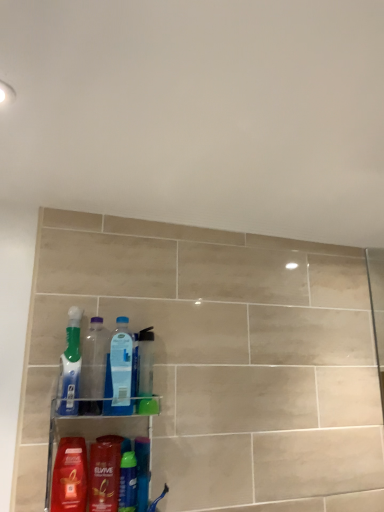
Question: Can you confirm if translucent plastic bottles at lower center is shorter than translucent plastic mouthwash at lower center, the first mouthwash from the left?

Choices:
 (A) yes
 (B) no

Answer: (B)

Question: From a real-world perspective, is translucent plastic bottles at lower center beneath translucent plastic mouthwash at lower center, the first mouthwash from the left?

Choices:
 (A) yes
 (B) no

Answer: (B)

Question: Is translucent plastic bottles at lower center closer to the viewer compared to translucent plastic mouthwash at lower center, the first mouthwash from the left?

Choices:
 (A) no
 (B) yes

Answer: (B)

Question: Is translucent plastic mouthwash at lower center, placed as the second mouthwash when sorted from right to left, located within translucent plastic bottles at lower center?

Choices:
 (A) no
 (B) yes

Answer: (B)

Question: Is translucent plastic bottles at lower center to the right of translucent plastic mouthwash at lower center, the first mouthwash from the left, from the viewer's perspective?

Choices:
 (A) no
 (B) yes

Answer: (B)

Question: Can you confirm if translucent plastic bottles at lower center is taller than translucent plastic mouthwash at lower center, placed as the second mouthwash when sorted from right to left?

Choices:
 (A) no
 (B) yes

Answer: (B)

Question: Can you confirm if translucent plastic mouthwash at lower center, the first mouthwash from the left, is smaller than green plastic mouthwash at lower center, which is counted as the 1th mouthwash, starting from the right?

Choices:
 (A) yes
 (B) no

Answer: (B)

Question: From a real-world perspective, is translucent plastic mouthwash at lower center, the first mouthwash from the left, on green plastic mouthwash at lower center, which appears as the 2th mouthwash when viewed from the left?

Choices:
 (A) yes
 (B) no

Answer: (A)

Question: Is the depth of translucent plastic mouthwash at lower center, the first mouthwash from the left, greater than that of green plastic mouthwash at lower center, which is counted as the 1th mouthwash, starting from the right?

Choices:
 (A) yes
 (B) no

Answer: (B)

Question: Is translucent plastic mouthwash at lower center, placed as the second mouthwash when sorted from right to left, beside green plastic mouthwash at lower center, which is counted as the 1th mouthwash, starting from the right?

Choices:
 (A) no
 (B) yes

Answer: (B)

Question: Can you confirm if translucent plastic mouthwash at lower center, the first mouthwash from the left, is shorter than green plastic mouthwash at lower center, which is counted as the 1th mouthwash, starting from the right?

Choices:
 (A) no
 (B) yes

Answer: (A)

Question: From the image's perspective, would you say translucent plastic mouthwash at lower center, the first mouthwash from the left, is positioned over green plastic mouthwash at lower center, which is counted as the 1th mouthwash, starting from the right?

Choices:
 (A) no
 (B) yes

Answer: (B)

Question: Is translucent plastic toothbrush at left, which is counted as the 2th cleaning product, starting from the bottom, looking in the opposite direction of translucent plastic bottles at lower center?

Choices:
 (A) no
 (B) yes

Answer: (A)